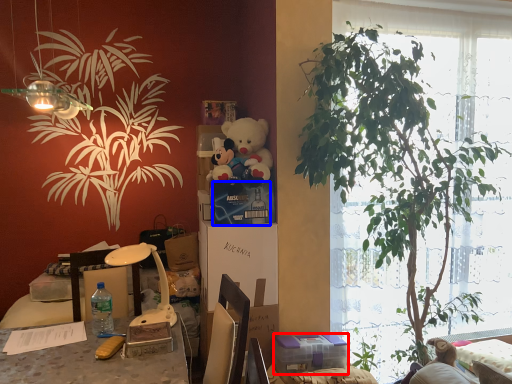
Question: Which of the following is the farthest to the observer, box (highlighted by a red box) or box (highlighted by a blue box)?

Choices:
 (A) box
 (B) box

Answer: (B)